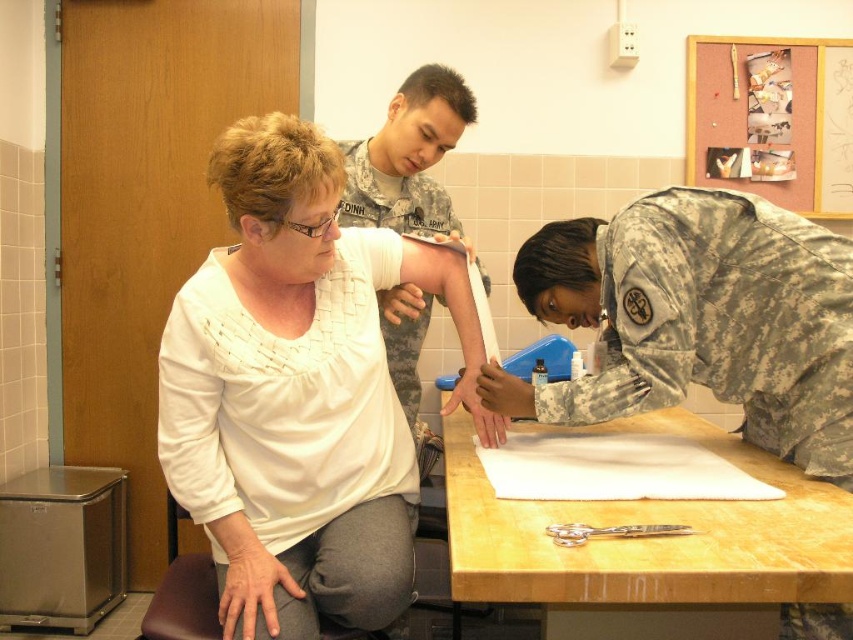
Question: Does white textured shirt at center lie in front of camouflage fabric uniform at upper center?

Choices:
 (A) no
 (B) yes

Answer: (B)

Question: Which object is closer to the camera taking this photo?

Choices:
 (A) camouflage fabric uniform at upper center
 (B) white textured shirt at center
 (C) wooden table at center
 (D) silver metallic scissors at lower center

Answer: (C)

Question: Estimate the real-world distances between objects in this image. Which object is closer to the silver metallic scissors at lower center?

Choices:
 (A) camouflage fabric uniform at upper center
 (B) white textured shirt at center
 (C) wooden table at center
 (D) camouflage fabric uniform at lower right

Answer: (C)

Question: Considering the relative positions of white textured shirt at center and camouflage fabric uniform at upper center in the image provided, where is white textured shirt at center located with respect to camouflage fabric uniform at upper center?

Choices:
 (A) above
 (B) below

Answer: (B)

Question: In this image, where is camouflage fabric uniform at lower right located relative to wooden table at center?

Choices:
 (A) below
 (B) above

Answer: (B)

Question: Among these objects, which one is nearest to the camera?

Choices:
 (A) white textured shirt at center
 (B) camouflage fabric uniform at upper center

Answer: (A)